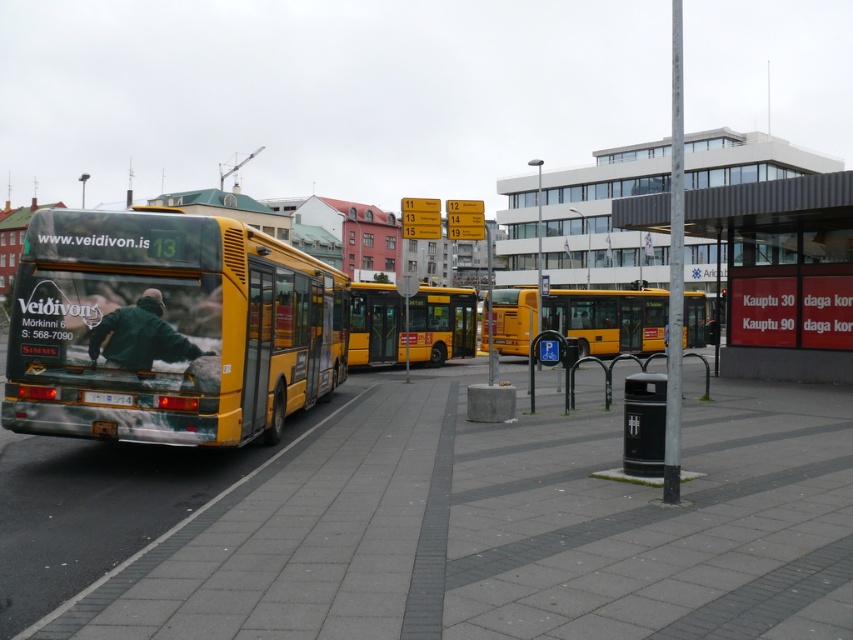
You are standing at the bus stop and want to know the position of two points marked on the ground. The first point is at coordinate point (508, 296) and the second point is at coordinate point (372, 289). Which point is closer to you?

Point (372, 289) is closer to you because it is in front of point (508, 296).

You are a pedestrian standing on the gray concrete pavement at center. You want to walk to the yellow metallic bus at center. Is the bus directly above you or to the side?

The gray concrete pavement at center is positioned under the yellow metallic bus at center, so the bus is directly above you.

You are a delivery person who needs to place a small package on the gray concrete pavement at center. According to the scene description, where exactly should you place it?

You should place the small package at point coordinates of (440,524) on the gray concrete pavement at center.